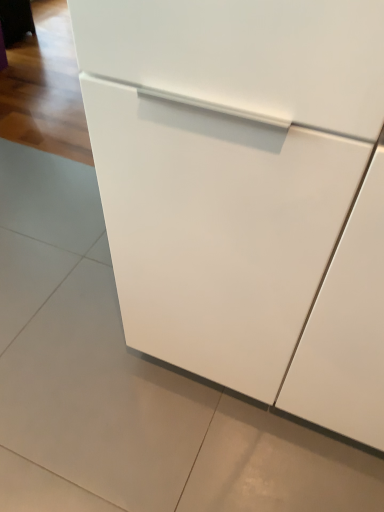
This screenshot has height=512, width=384. Find the location of `white matte cabinet at center`. white matte cabinet at center is located at coordinates (246, 193).

Measure the distance between point (337,389) and camera.

33.78 inches.

What do you see at coordinates (246, 193) in the screenshot? Image resolution: width=384 pixels, height=512 pixels. I see `white matte cabinet at center` at bounding box center [246, 193].

Find the location of a particular element. white matte cabinet at center is located at coordinates (246, 193).